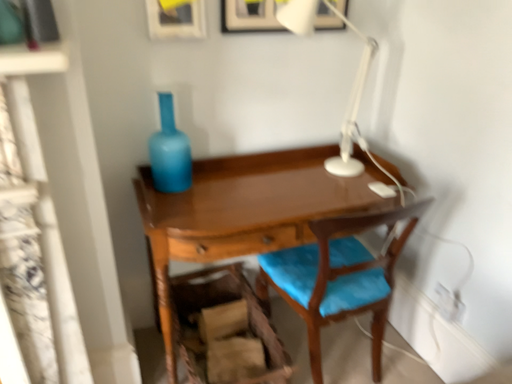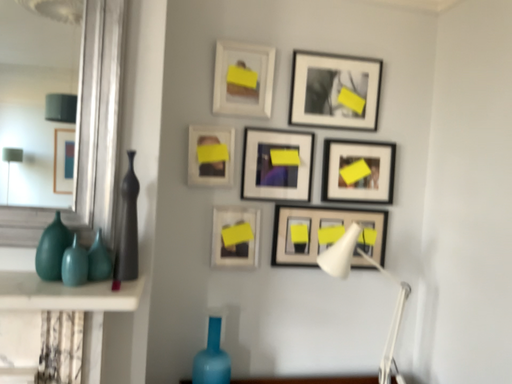
Question: How did the camera likely rotate when shooting the video?

Choices:
 (A) rotated downward
 (B) rotated upward

Answer: (B)